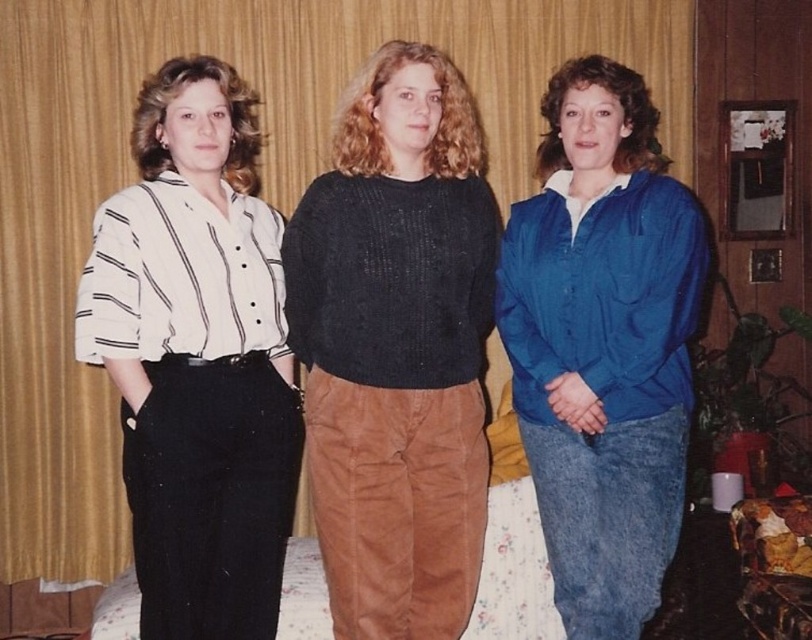
Question: Can you confirm if white striped shirt at left is positioned below blue denim jacket at center?

Choices:
 (A) yes
 (B) no

Answer: (A)

Question: Among these points, which one is farthest from the camera?

Choices:
 (A) (536, 580)
 (B) (378, 616)

Answer: (A)

Question: Which object is closer to the camera taking this photo?

Choices:
 (A) floral fabric bed at center
 (B) blue denim jacket at center
 (C) black knitted sweater at center
 (D) white striped shirt at left

Answer: (D)

Question: In this image, where is blue denim jacket at center located relative to floral fabric bed at center?

Choices:
 (A) above
 (B) below

Answer: (A)

Question: Can you confirm if blue denim jacket at center is smaller than floral fabric bed at center?

Choices:
 (A) no
 (B) yes

Answer: (A)

Question: Which point is closer to the camera?

Choices:
 (A) blue denim jacket at center
 (B) black knitted sweater at center

Answer: (A)